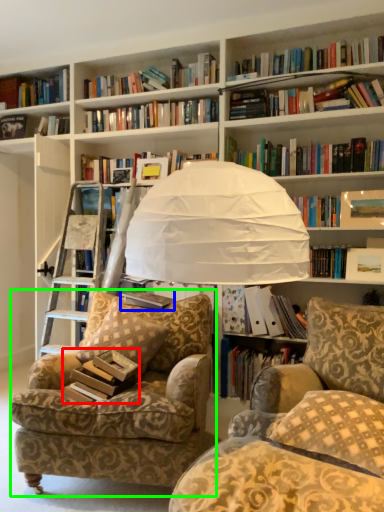
Question: Estimate the real-world distances between objects in this image. Which object is farther from paperback book (highlighted by a red box), book (highlighted by a blue box) or chair (highlighted by a green box)?

Choices:
 (A) book
 (B) chair

Answer: (A)